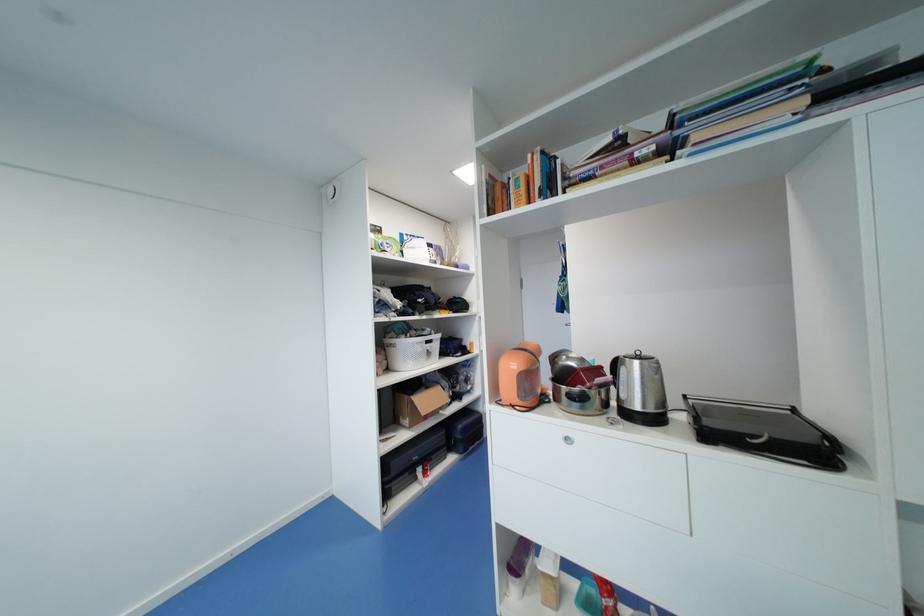
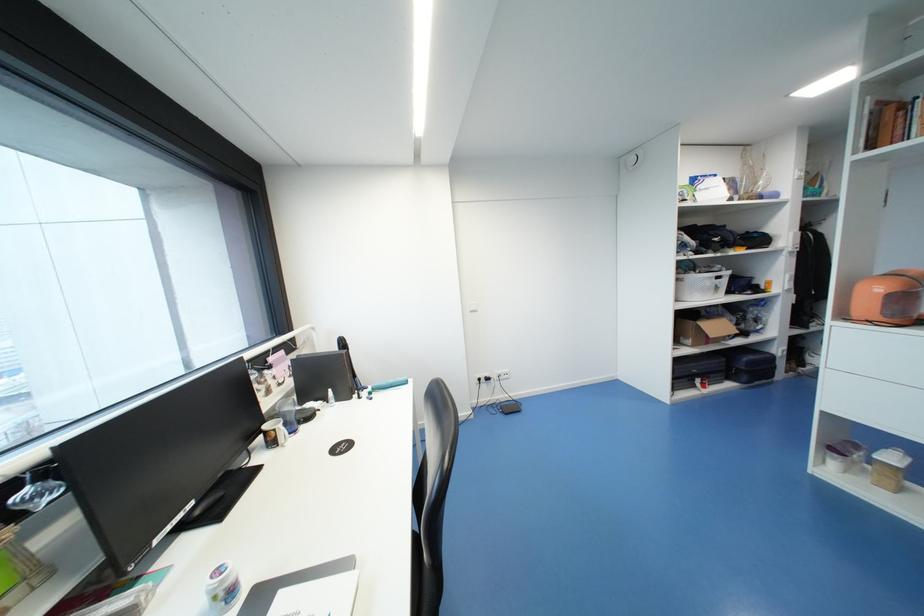
Where in the second image is the point corresponding to (x=518, y=589) from the first image?

(839, 464)